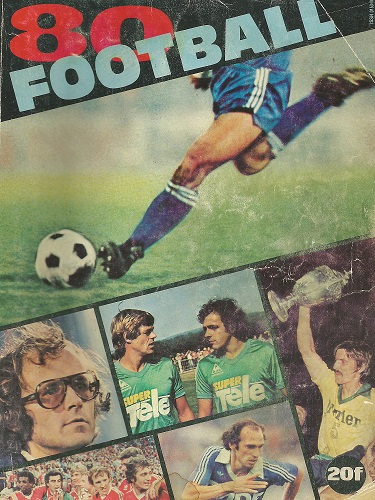
This screenshot has height=500, width=375. Identify the location of trophy. (325, 288).